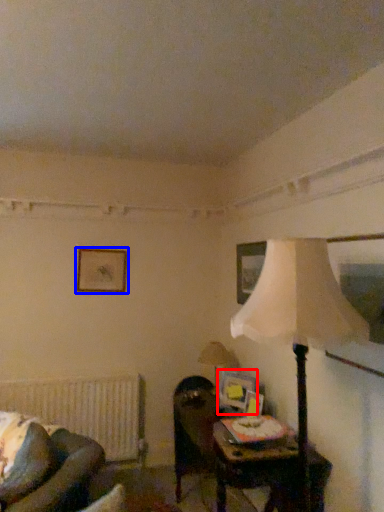
Question: Which object appears farthest to the camera in this image, picture frame (highlighted by a red box) or picture frame (highlighted by a blue box)?

Choices:
 (A) picture frame
 (B) picture frame

Answer: (B)